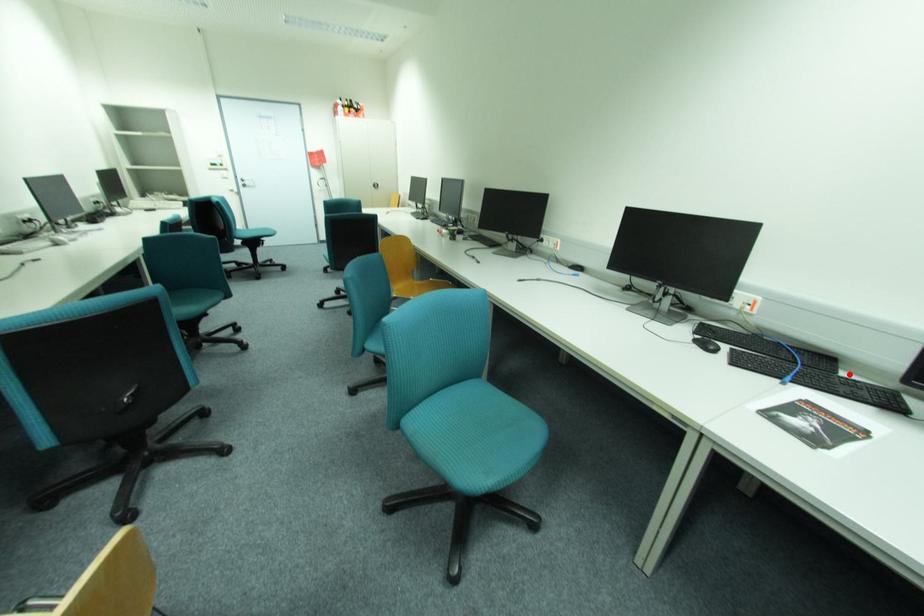
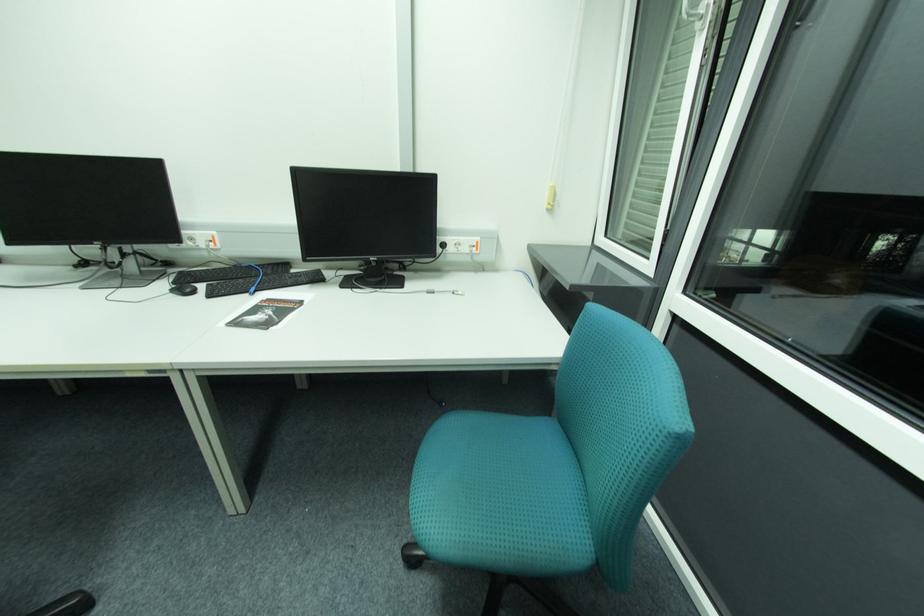
Question: I am providing you with two images of the same scene from different viewpoints. Image1 has a red point marked. In image2, the corresponding 3D location appears at what relative position? Reply with the corresponding letter.

Choices:
 (A) Closer
 (B) Farther

Answer: (A)